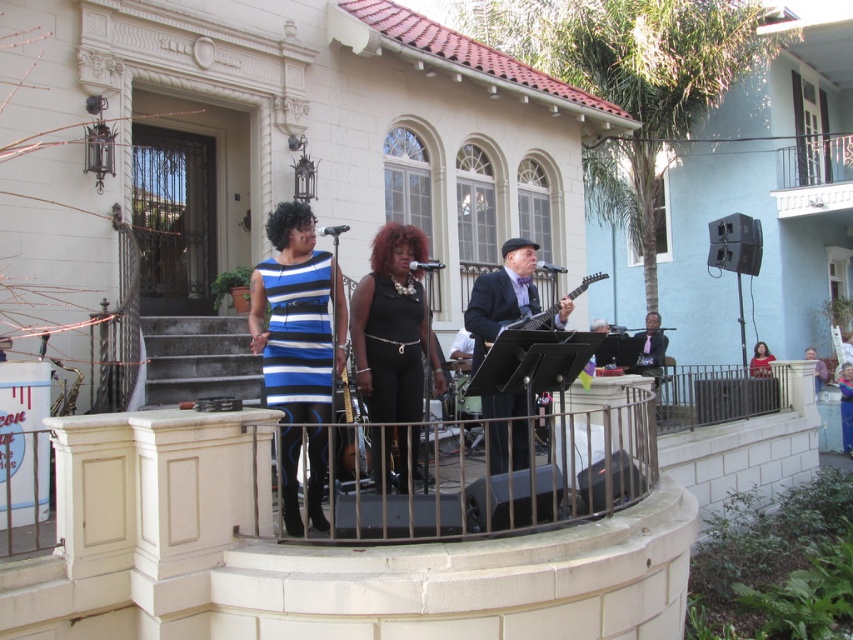
Question: From the image, what is the correct spatial relationship of shiny black suit at center in relation to matte black dress at center?

Choices:
 (A) above
 (B) below

Answer: (A)

Question: In this image, where is blue striped dress at center located relative to black satin dress at center?

Choices:
 (A) below
 (B) above

Answer: (B)

Question: Which point is farther from the camera taking this photo?

Choices:
 (A) (334, 355)
 (B) (416, 342)
 (C) (757, 346)
 (D) (505, 422)

Answer: (C)

Question: Estimate the real-world distances between objects in this image. Which object is farther from the black satin dress at center?

Choices:
 (A) blue striped dress at center
 (B) shiny black guitar at center
 (C) shiny black suit at center
 (D) matte black dress at center

Answer: (D)

Question: Is black satin dress at center smaller than matte black dress at center?

Choices:
 (A) no
 (B) yes

Answer: (A)

Question: Which point is farther to the camera?

Choices:
 (A) (340, 305)
 (B) (753, 346)
 (C) (399, 337)
 (D) (496, 312)

Answer: (B)